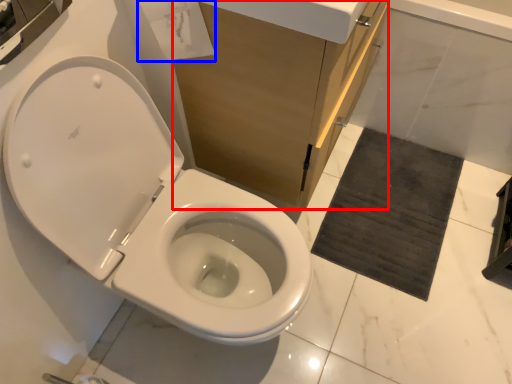
Question: Which object appears closest to the camera in this image, cabinetry (highlighted by a red box) or toilet paper (highlighted by a blue box)?

Choices:
 (A) cabinetry
 (B) toilet paper

Answer: (B)